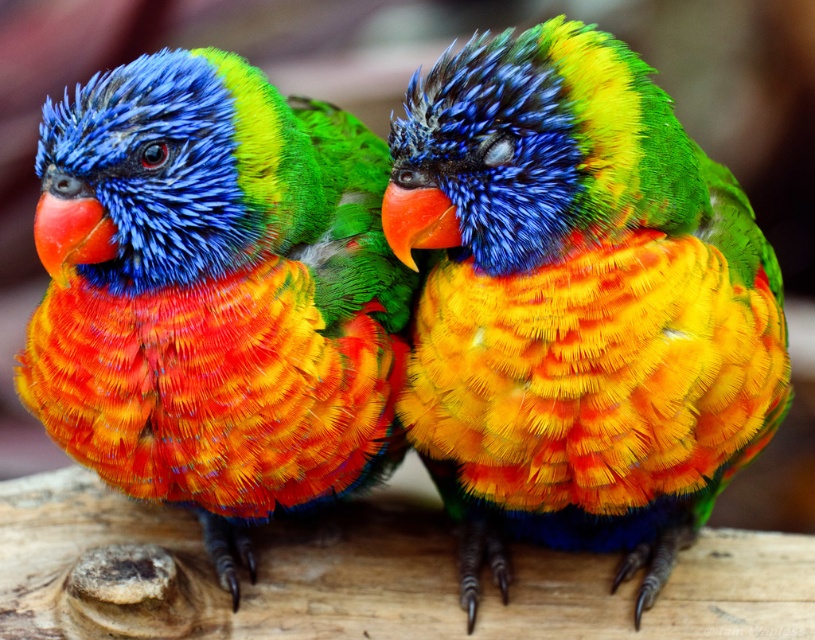
Who is shorter, shiny multicolored parrot at center or shiny multicolored parrot at left?

shiny multicolored parrot at left

Is point (548, 76) positioned after point (263, 81)?

No.

Find the location of a particular element. This screenshot has width=815, height=640. shiny multicolored parrot at center is located at coordinates (576, 305).